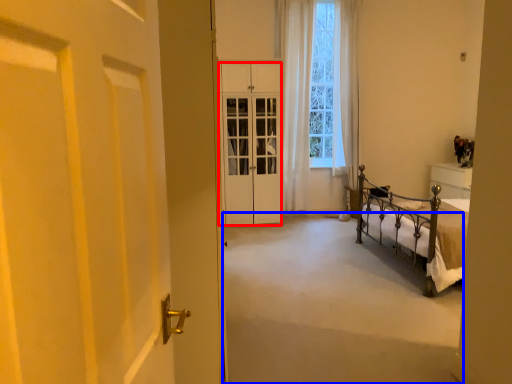
Question: Which object appears closest to the camera in this image, cabinetry (highlighted by a red box) or corridor (highlighted by a blue box)?

Choices:
 (A) cabinetry
 (B) corridor

Answer: (B)